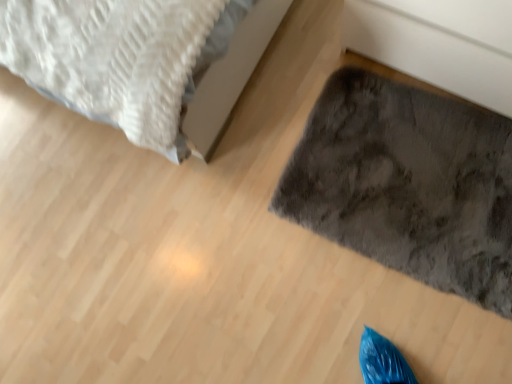
The width and height of the screenshot is (512, 384). I want to click on vacant space that is to the left of gray fluffy rug at lower right, so click(x=244, y=262).